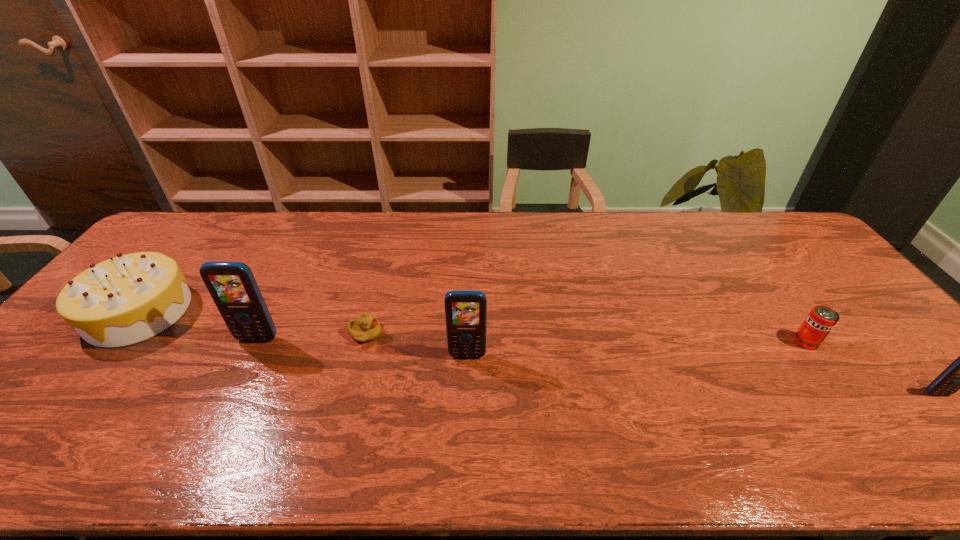
The image size is (960, 540). Find the location of `spot to insert another cellular_telephone for uniform distribution`. spot to insert another cellular_telephone for uniform distribution is located at coordinates (693, 374).